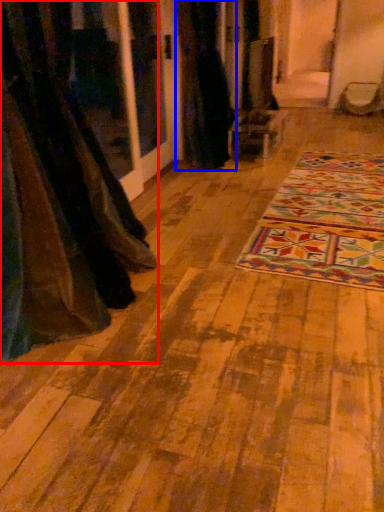
Question: Which object appears closest to the camera in this image, curtain (highlighted by a red box) or curtain (highlighted by a blue box)?

Choices:
 (A) curtain
 (B) curtain

Answer: (A)